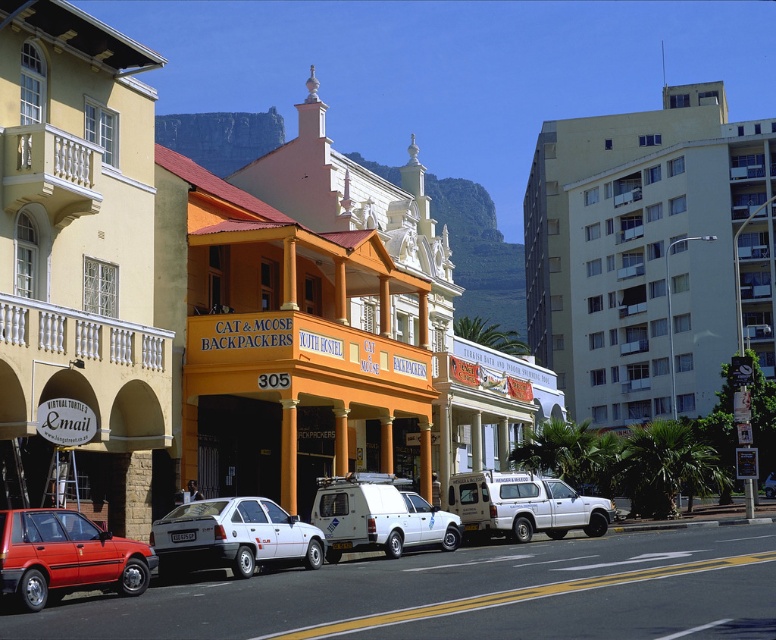
Who is shorter, matte red hatchback at lower left or white matte van at center?

matte red hatchback at lower left

Does matte red hatchback at lower left have a larger size compared to white matte van at center?

No.

Between point (12, 593) and point (324, 506), which one is positioned behind?

The point (324, 506) is behind.

Identify the location of matte red hatchback at lower left. The width and height of the screenshot is (776, 640). (64, 557).

Can you confirm if yellow painted building at left is taller than white matte van at center?

Correct, yellow painted building at left is much taller as white matte van at center.

Does point (130, 230) come farther from viewer compared to point (369, 483)?

Yes, it is.

This screenshot has width=776, height=640. What are the coordinates of `yellow painted building at left` in the screenshot? It's located at (78, 256).

Who is shorter, matte red hatchback at lower left or white matte suv at center?

matte red hatchback at lower left

Does matte red hatchback at lower left have a lesser width compared to white matte suv at center?

Indeed, matte red hatchback at lower left has a lesser width compared to white matte suv at center.

Describe the element at coordinates (64, 557) in the screenshot. This screenshot has width=776, height=640. I see `matte red hatchback at lower left` at that location.

Identify the location of matte red hatchback at lower left. The width and height of the screenshot is (776, 640). (64, 557).